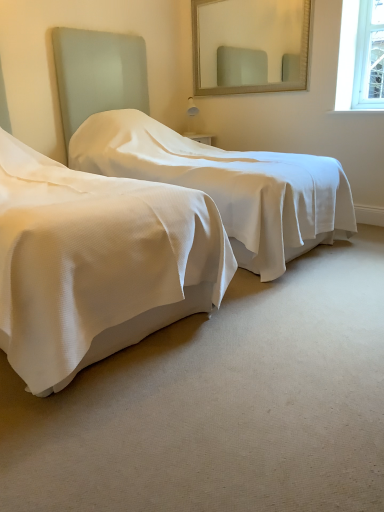
Measure the distance between matte glass mirror at upper center and camera.

matte glass mirror at upper center and camera are 11.19 feet apart.

The width and height of the screenshot is (384, 512). I want to click on white textured bed at left, the first bed in the right-to-left sequence, so click(194, 155).

Where is `matte glass mirror at upper center`? matte glass mirror at upper center is located at coordinates (251, 42).

Which object is closer to the camera, white textured bed at left, which is the 2th bed in left-to-right order, or matte glass mirror at upper center?

white textured bed at left, which is the 2th bed in left-to-right order, is in front.

Is white textured bed at left, which is the 2th bed in left-to-right order, looking in the opposite direction of matte glass mirror at upper center?

white textured bed at left, which is the 2th bed in left-to-right order, is not turned away from matte glass mirror at upper center.

Identify the location of the 1st bed below the matte glass mirror at upper center (from the image's perspective). (194, 155).

From a real-world perspective, who is located lower, white textured bed at left, which is the 2th bed in left-to-right order, or matte glass mirror at upper center?

From a 3D spatial view, white textured bed at left, which is the 2th bed in left-to-right order, is below.

Can you confirm if matte glass mirror at upper center is wider than white textured bed at center, placed as the first bed when sorted from left to right?

Incorrect, the width of matte glass mirror at upper center does not surpass that of white textured bed at center, placed as the first bed when sorted from left to right.

Is matte glass mirror at upper center bigger or smaller than white textured bed at center, placed as the first bed when sorted from left to right?

In the image, matte glass mirror at upper center appears to be smaller than white textured bed at center, placed as the first bed when sorted from left to right.

From a real-world perspective, is matte glass mirror at upper center physically below white textured bed at center, which is the 2th bed from right to left?

No, from a real-world perspective, matte glass mirror at upper center is not beneath white textured bed at center, which is the 2th bed from right to left.

What's the angular difference between matte glass mirror at upper center and white textured bed at center, which is the 2th bed from right to left,'s facing directions?

There is a 88.5-degree angle between the facing directions of matte glass mirror at upper center and white textured bed at center, which is the 2th bed from right to left.

From a real-world perspective, is matte glass mirror at upper center over white textured bed at left, the first bed in the right-to-left sequence?

Yes, from a real-world perspective, matte glass mirror at upper center is on top of white textured bed at left, the first bed in the right-to-left sequence.

Considering the relative sizes of matte glass mirror at upper center and white textured bed at left, which is the 2th bed in left-to-right order, in the image provided, is matte glass mirror at upper center smaller than white textured bed at left, which is the 2th bed in left-to-right order,?

Yes, matte glass mirror at upper center is smaller than white textured bed at left, which is the 2th bed in left-to-right order.

Is matte glass mirror at upper center at the right side of white textured bed at left, which is the 2th bed in left-to-right order?

Yes.

From the image's perspective, is matte glass mirror at upper center positioned above or below white textured bed at left, the first bed in the right-to-left sequence?

Based on their image positions, matte glass mirror at upper center is located above white textured bed at left, the first bed in the right-to-left sequence.

From the picture: Considering the relative sizes of white textured bed at center, which is the 2th bed from right to left, and white textured bed at left, the first bed in the right-to-left sequence, in the image provided, is white textured bed at center, which is the 2th bed from right to left, wider than white textured bed at left, the first bed in the right-to-left sequence,?

Yes.

From a real-world perspective, is white textured bed at center, which is the 2th bed from right to left, positioned under white textured bed at left, which is the 2th bed in left-to-right order, based on gravity?

Yes, from a real-world perspective, white textured bed at center, which is the 2th bed from right to left, is beneath white textured bed at left, which is the 2th bed in left-to-right order.

From the image's perspective, is white textured bed at center, which is the 2th bed from right to left, above or below white textured bed at left, the first bed in the right-to-left sequence?

white textured bed at center, which is the 2th bed from right to left, is situated lower than white textured bed at left, the first bed in the right-to-left sequence, in the image.

Could white textured bed at left, the first bed in the right-to-left sequence, be considered to be inside white textured bed at center, which is the 2th bed from right to left?

Actually, white textured bed at left, the first bed in the right-to-left sequence, is outside white textured bed at center, which is the 2th bed from right to left.

Is point (3, 180) positioned behind point (213, 71)?

That is False.

From the image's perspective, who appears lower, white textured bed at center, which is the 2th bed from right to left, or matte glass mirror at upper center?

white textured bed at center, which is the 2th bed from right to left, is shown below in the image.

Considering the sizes of white textured bed at center, which is the 2th bed from right to left, and matte glass mirror at upper center in the image, is white textured bed at center, which is the 2th bed from right to left, taller or shorter than matte glass mirror at upper center?

Considering their sizes, white textured bed at center, which is the 2th bed from right to left, has more height than matte glass mirror at upper center.

Does white textured bed at left, the first bed in the right-to-left sequence, touch white textured bed at center, placed as the first bed when sorted from left to right?

They are not placed beside each other.

From the image's perspective, between white textured bed at left, the first bed in the right-to-left sequence, and white textured bed at center, placed as the first bed when sorted from left to right, who is located below?

white textured bed at center, placed as the first bed when sorted from left to right, from the image's perspective.

Find the location of a particular element. The height and width of the screenshot is (512, 384). bed on the left of white textured bed at left, the first bed in the right-to-left sequence is located at coordinates (97, 263).

Considering the points (222, 182) and (51, 286), which point is in front, point (222, 182) or point (51, 286)?

The point (51, 286) is more forward.

I want to click on the 1st bed to the left of the matte glass mirror at upper center, counting from the anchor's position, so click(x=194, y=155).

This screenshot has height=512, width=384. Find the location of `mirror above the white textured bed at center, which is the 2th bed from right to left (from a real-world perspective)`. mirror above the white textured bed at center, which is the 2th bed from right to left (from a real-world perspective) is located at coordinates (251, 42).

When comparing their distances from white textured bed at left, which is the 2th bed in left-to-right order, does matte glass mirror at upper center or white textured bed at center, which is the 2th bed from right to left, seem further?

matte glass mirror at upper center is further to white textured bed at left, which is the 2th bed in left-to-right order.

Looking at this image, which object lies further to the anchor point white textured bed at center, placed as the first bed when sorted from left to right, matte glass mirror at upper center or white textured bed at left, which is the 2th bed in left-to-right order?

matte glass mirror at upper center.

Which object lies nearer to the anchor point matte glass mirror at upper center, white textured bed at center, placed as the first bed when sorted from left to right, or white textured bed at left, the first bed in the right-to-left sequence?

The object closer to matte glass mirror at upper center is white textured bed at left, the first bed in the right-to-left sequence.

Which object lies further to the anchor point white textured bed at center, which is the 2th bed from right to left, white textured bed at left, the first bed in the right-to-left sequence, or matte glass mirror at upper center?

The object further to white textured bed at center, which is the 2th bed from right to left, is matte glass mirror at upper center.

Based on the photo, estimate the real-world distances between objects in this image. Which object is closer to matte glass mirror at upper center, white textured bed at left, which is the 2th bed in left-to-right order, or white textured bed at center, placed as the first bed when sorted from left to right?

Based on the image, white textured bed at left, which is the 2th bed in left-to-right order, appears to be nearer to matte glass mirror at upper center.

Looking at the image, which one is located closer to white textured bed at left, the first bed in the right-to-left sequence, white textured bed at center, which is the 2th bed from right to left, or matte glass mirror at upper center?

Among the two, white textured bed at center, which is the 2th bed from right to left, is located nearer to white textured bed at left, the first bed in the right-to-left sequence.

Where is `bed positioned between white textured bed at center, placed as the first bed when sorted from left to right, and matte glass mirror at upper center from near to far`? This screenshot has height=512, width=384. bed positioned between white textured bed at center, placed as the first bed when sorted from left to right, and matte glass mirror at upper center from near to far is located at coordinates (194, 155).